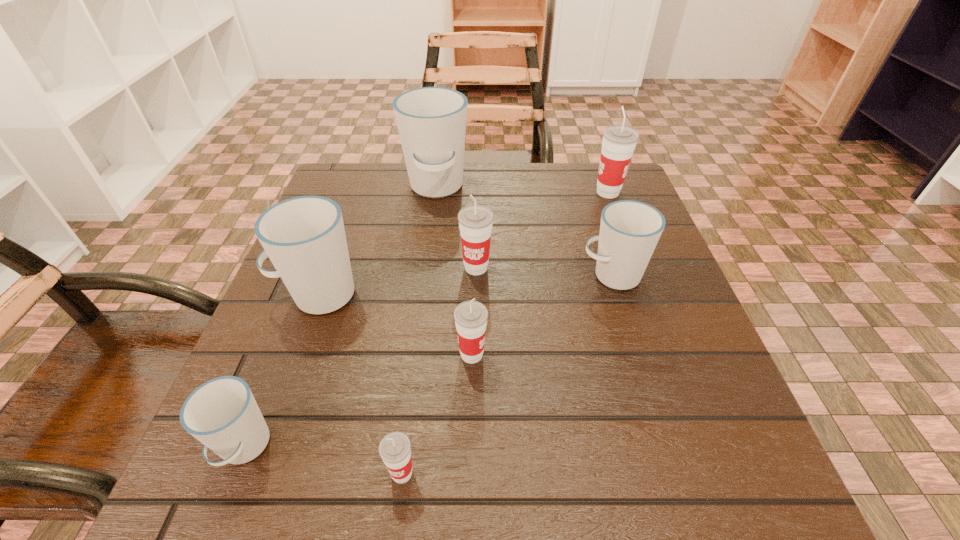
You are a GUI agent. You are given a task and a screenshot of the screen. Output one action in this format:
    pyautogui.click(x=<x>, y=<y>)
    Task: Click on the vacant space that's between the second farthest red cup and the nearest red cup
    
    Given the screenshot: What is the action you would take?
    pyautogui.click(x=439, y=370)

Identify the location of empty space that is in between the second biggest red cup and the second white cup from right to left. (456, 228).

Locate an element on the screen. empty space between the rightmost red cup and the third nearest red cup is located at coordinates (542, 230).

Where is `free spot between the sixth farthest cup and the smallest white cup`? The width and height of the screenshot is (960, 540). free spot between the sixth farthest cup and the smallest white cup is located at coordinates (358, 401).

Locate an element on the screen. Image resolution: width=960 pixels, height=540 pixels. free space between the leftmost red cup and the second smallest white cup is located at coordinates (507, 374).

The image size is (960, 540). In order to click on free space between the nearest red cup and the sixth farthest cup in this screenshot , I will do `click(437, 414)`.

This screenshot has height=540, width=960. I want to click on object that can be found as the fifth closest to the second biggest white cup, so click(x=395, y=448).

At what (x,y) coordinates should I click in order to perform the action: click on object that is the fourth closest one to the smallest white cup. Please return your answer as a coordinate pair (x, y). The image size is (960, 540). Looking at the image, I should click on [475, 221].

Locate which cup is the third closest to the smallest white cup. Please provide its 2D coordinates. Your answer should be formatted as a tuple, i.e. [(x, y)], where the tuple contains the x and y coordinates of a point satisfying the conditions above.

[(471, 316)]

Locate an element on the screen. This screenshot has width=960, height=540. the seventh closest cup to the third smallest white cup is located at coordinates (619, 141).